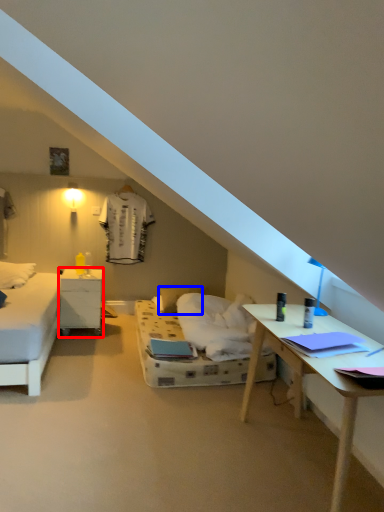
Question: Which of the following is the farthest to the observer, nightstand (highlighted by a red box) or pillow (highlighted by a blue box)?

Choices:
 (A) nightstand
 (B) pillow

Answer: (B)